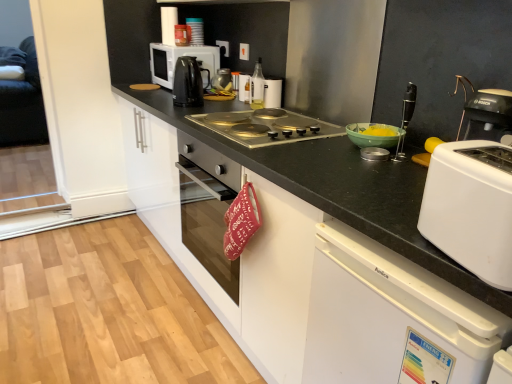
You are a GUI agent. You are given a task and a screenshot of the screen. Output one action in this format:
    pyautogui.click(x=<x>, y=<y>)
    Task: Click on the free space that is to the left of clear glass bottle at center, the second kitchen appliance in the right-to-left sequence
    The height and width of the screenshot is (384, 512).
    Given the screenshot: What is the action you would take?
    pyautogui.click(x=233, y=104)